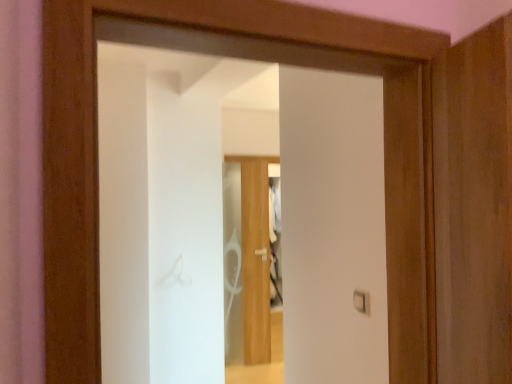
Question: Do you think transparent glass door at center is within white plastic light switch at center, or outside of it?

Choices:
 (A) outside
 (B) inside

Answer: (A)

Question: Is transparent glass door at center bigger or smaller than white plastic light switch at center?

Choices:
 (A) small
 (B) big

Answer: (B)

Question: Is transparent glass door at center taller or shorter than white plastic light switch at center?

Choices:
 (A) short
 (B) tall

Answer: (B)

Question: From the image's perspective, is white plastic light switch at center positioned above or below transparent glass door at center?

Choices:
 (A) below
 (B) above

Answer: (A)

Question: In terms of size, does white plastic light switch at center appear bigger or smaller than transparent glass door at center?

Choices:
 (A) small
 (B) big

Answer: (A)

Question: Considering the positions of white plastic light switch at center and transparent glass door at center in the image, is white plastic light switch at center taller or shorter than transparent glass door at center?

Choices:
 (A) short
 (B) tall

Answer: (A)

Question: Does point (360, 296) appear closer or farther from the camera than point (346, 48)?

Choices:
 (A) closer
 (B) farther

Answer: (B)